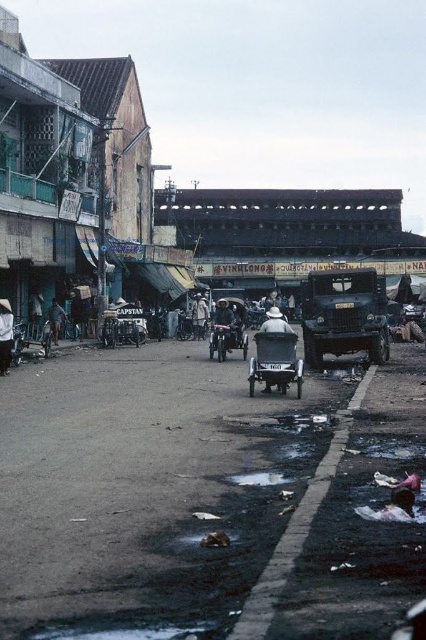
Question: Can you confirm if white matte tricycle at center is positioned to the right of white matte hat at center?

Choices:
 (A) no
 (B) yes

Answer: (B)

Question: Considering the real-world distances, which object is farthest from the dark blue fabric hat at left?

Choices:
 (A) white matte hat at center
 (B) matte green military vehicle at center

Answer: (A)

Question: Which point is farther to the camera?

Choices:
 (A) matte green military vehicle at center
 (B) white matte hat at center
 (C) dark blue fabric umbrella at center
 (D) light brown fabric hat at center

Answer: (D)

Question: Among these points, which one is farthest from the camera?

Choices:
 (A) coord(0,298)
 (B) coord(276,310)
 (C) coord(351,300)
 (D) coord(233,323)

Answer: (A)

Question: Is white fabric hat at center to the right of light brown fabric hat at center from the viewer's perspective?

Choices:
 (A) yes
 (B) no

Answer: (B)

Question: Is white matte tricycle at center wider than white matte hat at center?

Choices:
 (A) no
 (B) yes

Answer: (B)